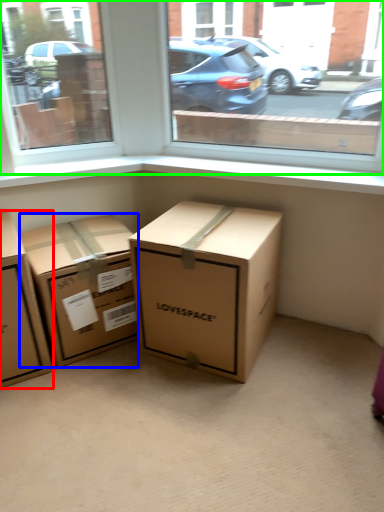
Question: Which object is the farthest from box (highlighted by a red box)? Choose among these: box (highlighted by a blue box) or window (highlighted by a green box).

Choices:
 (A) box
 (B) window

Answer: (B)